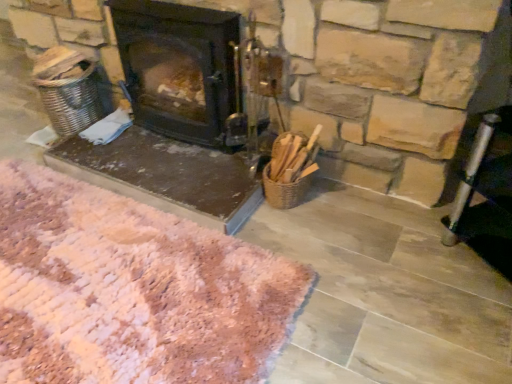
Question: Is pink shaggy rug at lower left spatially inside black matte wood burning stove at center, or outside of it?

Choices:
 (A) inside
 (B) outside

Answer: (B)

Question: Considering the positions of point (197, 253) and point (155, 6), is point (197, 253) closer or farther from the camera than point (155, 6)?

Choices:
 (A) closer
 (B) farther

Answer: (A)

Question: From a real-world perspective, is pink shaggy rug at lower left physically located above or below black matte wood burning stove at center?

Choices:
 (A) below
 (B) above

Answer: (A)

Question: Is black matte wood burning stove at center spatially inside pink shaggy rug at lower left, or outside of it?

Choices:
 (A) inside
 (B) outside

Answer: (B)

Question: Considering the positions of point (158, 41) and point (18, 274), is point (158, 41) closer or farther from the camera than point (18, 274)?

Choices:
 (A) farther
 (B) closer

Answer: (A)

Question: Relative to pink shaggy rug at lower left, is black matte wood burning stove at center in front or behind?

Choices:
 (A) behind
 (B) front

Answer: (A)

Question: Is black matte wood burning stove at center to the left or to the right of pink shaggy rug at lower left in the image?

Choices:
 (A) left
 (B) right

Answer: (B)